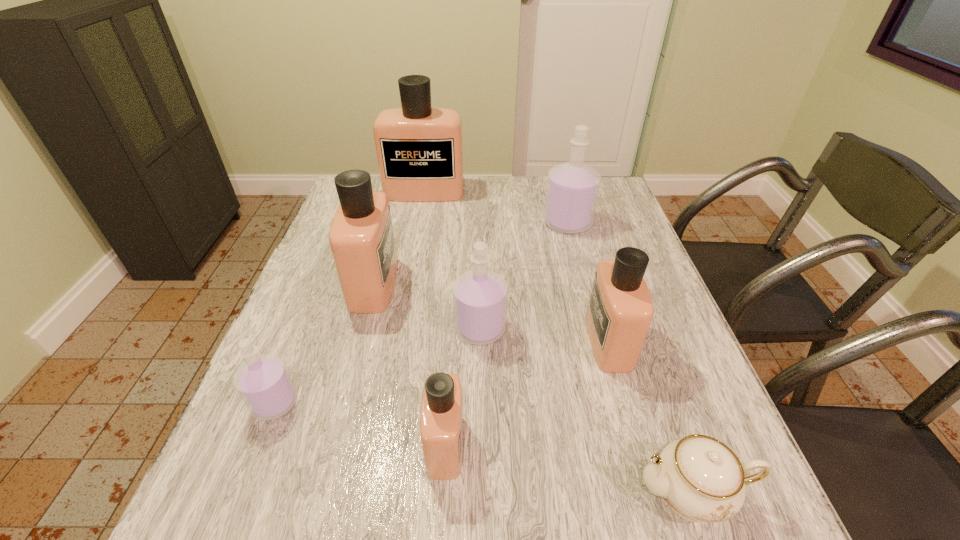
Identify the location of vacant position located on the front label of the smallest beige perfume. This screenshot has width=960, height=540. (552, 444).

This screenshot has width=960, height=540. I want to click on vacant area located at the spout of the chinaware, so click(429, 493).

Locate an element on the screen. The image size is (960, 540). free location located at the spout of the chinaware is located at coordinates (484, 493).

Find the location of `free space located 0.380m at the spout of the chinaware`. free space located 0.380m at the spout of the chinaware is located at coordinates (405, 493).

Where is `object positioned at the near edge`? The width and height of the screenshot is (960, 540). object positioned at the near edge is located at coordinates (701, 479).

Find the location of a particular element. Image resolution: width=960 pixels, height=540 pixels. chinaware present at the right edge is located at coordinates (701, 479).

You are a GUI agent. You are given a task and a screenshot of the screen. Output one action in this format:
    pyautogui.click(x=<x>, y=<y>)
    Task: Click on the object present at the far left corner
    This screenshot has height=540, width=960.
    Given the screenshot: What is the action you would take?
    pyautogui.click(x=419, y=148)

Identify the location of object present at the far right corner. Image resolution: width=960 pixels, height=540 pixels. (572, 190).

Find the location of a particular element. object positioned at the near right corner is located at coordinates (701, 479).

The image size is (960, 540). Identify the location of vacant space at the far edge. (396, 204).